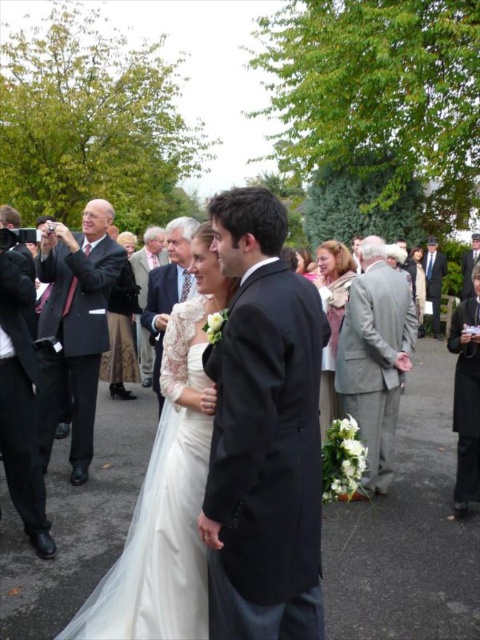
Looking at this image, you are a photographer preparing to take a group photo of the wedding party. You need to position the photographer at point A, which is at coordinates (x=264, y=433). The black satin suit at center is located at this point. Where should you place the photographer to ensure they are not blocking the view of the black satin suit at center?

The photographer should not be placed at point A because the black satin suit at center is already located there, which would block the view. Choose a different position that allows the photographer to capture the black satin suit at center without obstruction.

You are a photographer at the wedding scene. You want to take a photo of the dark blue suit at right. Where should you focus your camera? Please provide coordinates in the format of x,y between 0 and 1.

The dark blue suit at right is located at point (433,280). Focus your camera there.

You are a photographer at a wedding. You need to position a light reflector to bounce light onto the white satin dress at center and the shiny black suit at left. Based on their positions, where should you place the reflector relative to the subjects?

The white satin dress at center is located below the shiny black suit at left, so you should position the reflector below the subjects to bounce light upward toward the dress and the suit.